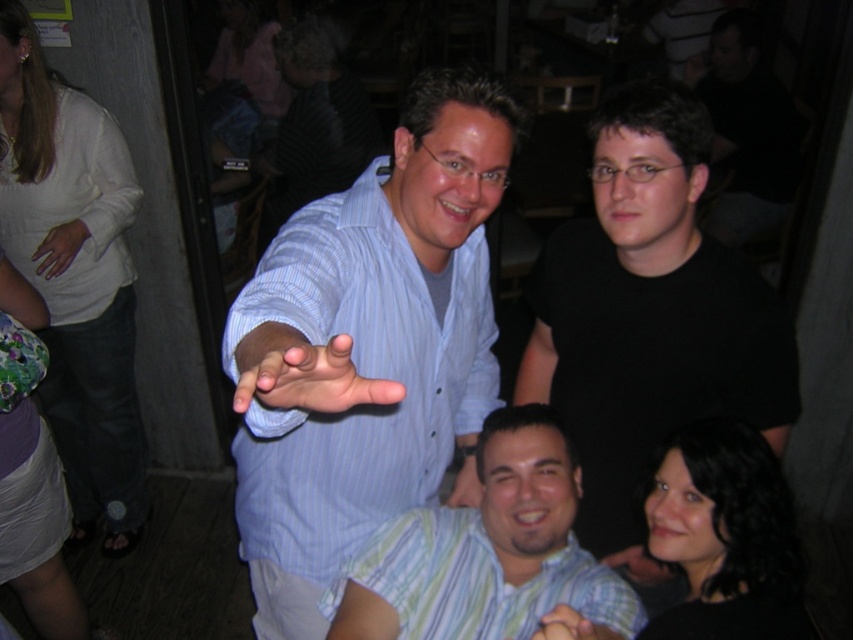
Question: Estimate the real-world distances between objects in this image. Which object is closer to the black matte shirt at upper right?

Choices:
 (A) matte black hand at lower center
 (B) matte skin hand at center
 (C) blue striped shirt at center

Answer: (C)

Question: Does white cotton shirt at upper left appear on the right side of matte black hand at lower center?

Choices:
 (A) no
 (B) yes

Answer: (A)

Question: Which point is closer to the camera taking this photo?

Choices:
 (A) (78, 228)
 (B) (47, 406)

Answer: (A)

Question: Which point appears closest to the camera in this image?

Choices:
 (A) (76, 237)
 (B) (759, 579)

Answer: (B)

Question: Does white cotton shirt at upper left appear under matte black hand at lower center?

Choices:
 (A) no
 (B) yes

Answer: (A)

Question: Does white cotton shirt at upper left appear on the right side of matte blue shirt at center?

Choices:
 (A) yes
 (B) no

Answer: (B)